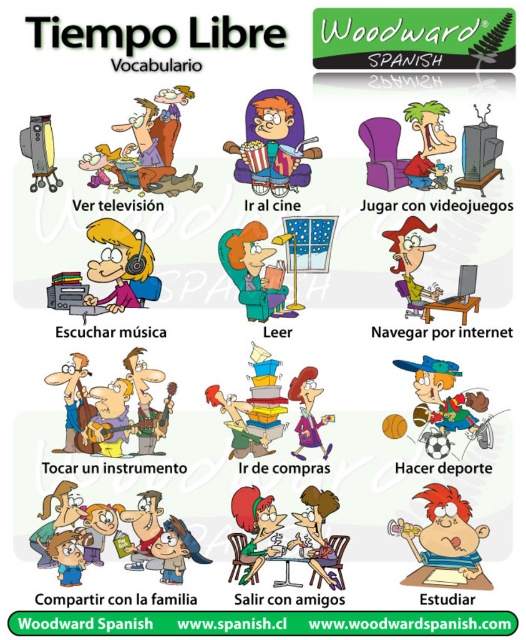
You are a Spanish student looking at the poster and notice the orange hair at center and the matte green sweater at center. Which object is positioned higher on the poster?

The orange hair at center is located above the matte green sweater at center, so it is positioned higher on the poster.